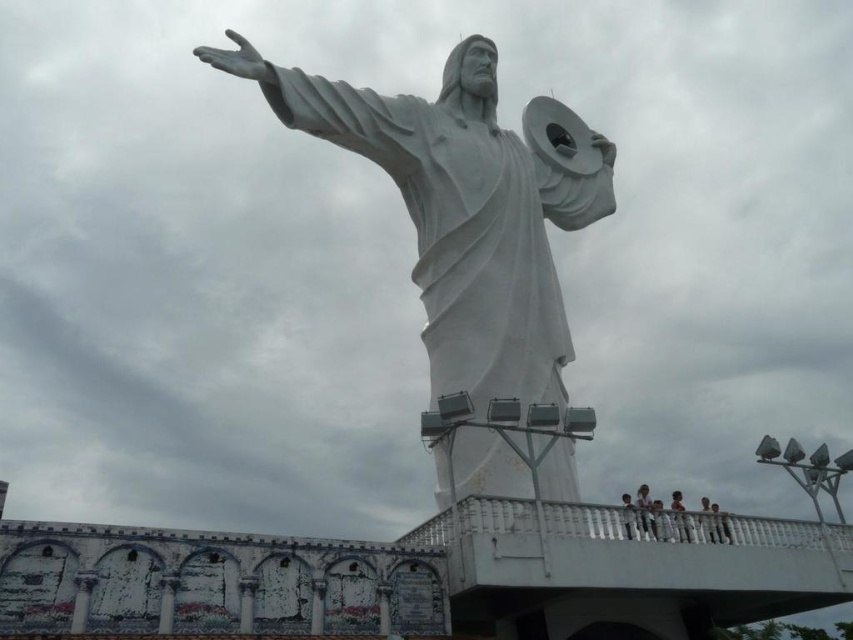
You are a visitor standing at the base of the white marble statue at center. You want to take a photo of the statue with the light brown wooden fence at lower right in the background. Is the fence visible behind the statue?

The light brown wooden fence at lower right is behind the white marble statue at center, so it will be visible in the background of the photo.

You are standing on the platform of the statue and want to get a closer look at the white marble person at lower right. Which direction should you move relative to the light brown wooden railing at lower center?

To get closer to the white marble person at lower right, you should move downward from the light brown wooden railing at lower center since the railing is above it.